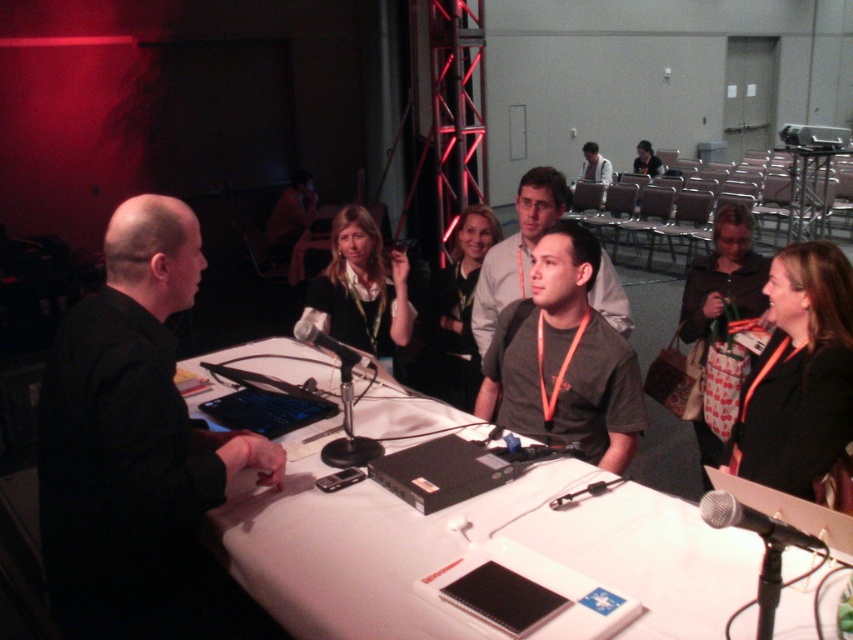
Question: Among these objects, which one is nearest to the camera?

Choices:
 (A) white matte table at center
 (B) black fabric shirt at center
 (C) black matte shirt at left
 (D) dark gray t-shirt at center

Answer: (A)

Question: Is black plastic laptop at center positioned in front of silver metallic microphone at lower right?

Choices:
 (A) no
 (B) yes

Answer: (A)

Question: Which object appears closest to the camera in this image?

Choices:
 (A) light gray shirt at upper center
 (B) black plastic laptop at center
 (C) gray fabric shirt at center
 (D) black fabric jacket at upper right

Answer: (D)

Question: Estimate the real-world distances between objects in this image. Which object is farther from the black fabric shirt at center?

Choices:
 (A) light gray shirt at upper center
 (B) black fabric bag at center
 (C) dark gray t-shirt at center
 (D) gray fabric shirt at center

Answer: (A)

Question: Can you confirm if white matte table at center is smaller than black metallic microphone at center?

Choices:
 (A) yes
 (B) no

Answer: (B)

Question: Where is white matte table at center located in relation to black fabric bag at center in the image?

Choices:
 (A) below
 (B) above

Answer: (A)